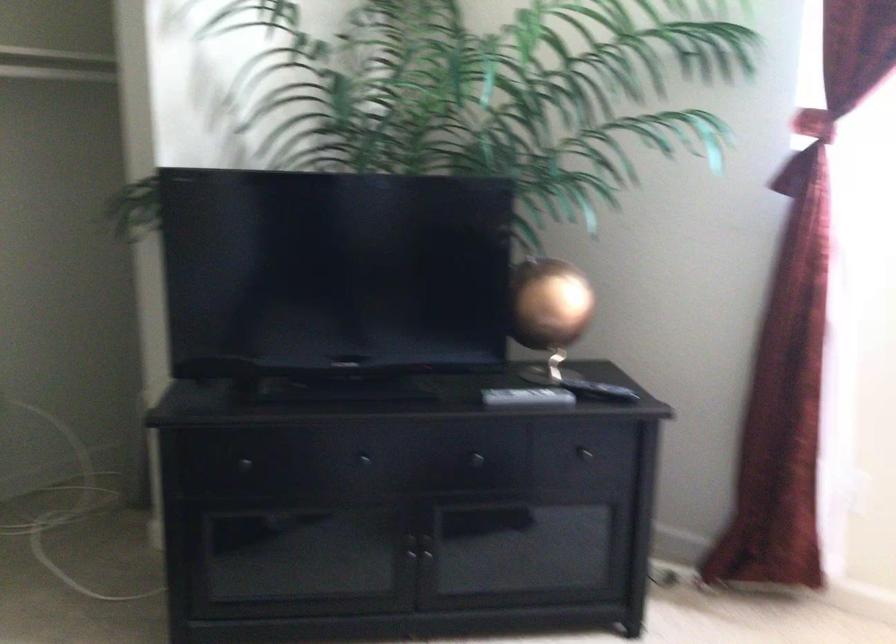
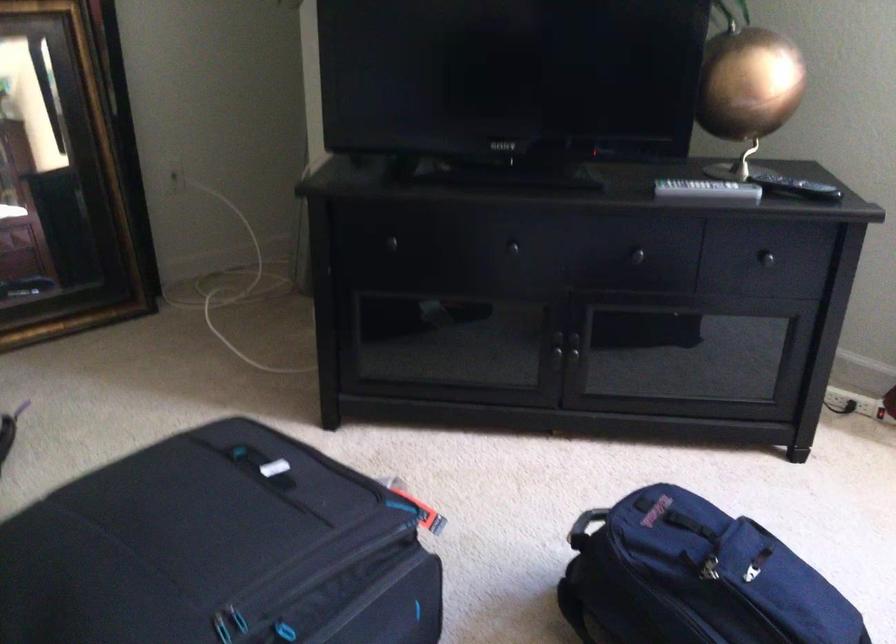
Where in the second image is the point corresponding to pixel 410 554 from the first image?

(556, 353)